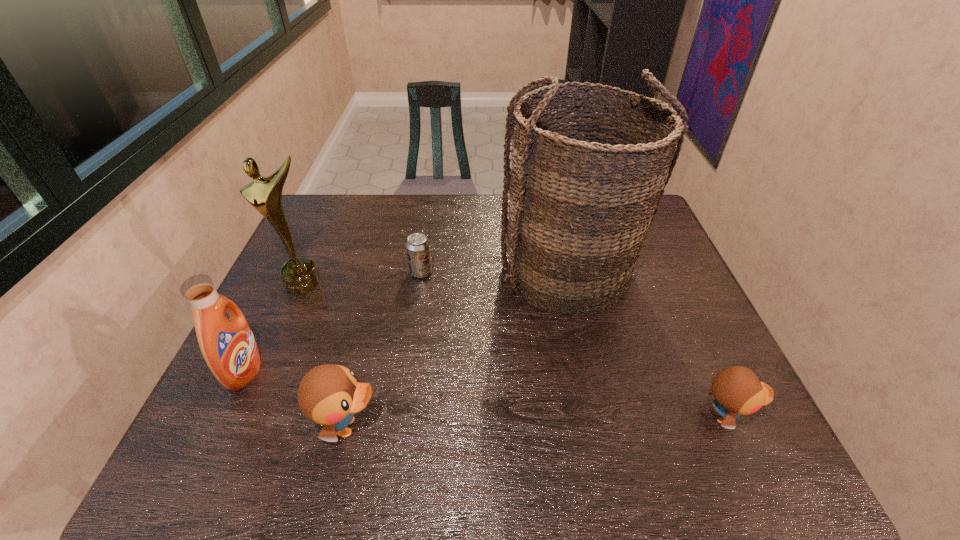
You are a GUI agent. You are given a task and a screenshot of the screen. Output one action in this format:
    pyautogui.click(x=<x>, y=<y>)
    Task: Click on the free space located 0.210m on the front-facing side of the taller duck
    The height and width of the screenshot is (540, 960).
    Given the screenshot: What is the action you would take?
    pyautogui.click(x=482, y=427)

This screenshot has height=540, width=960. I want to click on free space located 0.210m on the right of the beer can, so click(x=505, y=273).

The image size is (960, 540). What are the coordinates of `vacant space located 0.110m on the back of the tallest object` in the screenshot? It's located at (555, 217).

This screenshot has width=960, height=540. I want to click on vacant area situated 0.180m on the front-facing side of the award, so click(276, 346).

At what (x,y) coordinates should I click in order to perform the action: click on free space located on the front-facing side of the fourth shortest object. Please return your answer as a coordinate pair (x, y). The width and height of the screenshot is (960, 540). Looking at the image, I should click on (400, 372).

Locate an element on the screen. The image size is (960, 540). detergent at the near edge is located at coordinates (228, 346).

Find the location of a particular element. The width and height of the screenshot is (960, 540). award that is at the left edge is located at coordinates (299, 275).

Where is `detergent located in the left edge section of the desktop`? detergent located in the left edge section of the desktop is located at coordinates point(228,346).

Find the location of a particular element. duck positioned at the right edge is located at coordinates (737, 390).

Locate an element on the screen. This screenshot has width=960, height=540. basket that is at the right edge is located at coordinates (583, 192).